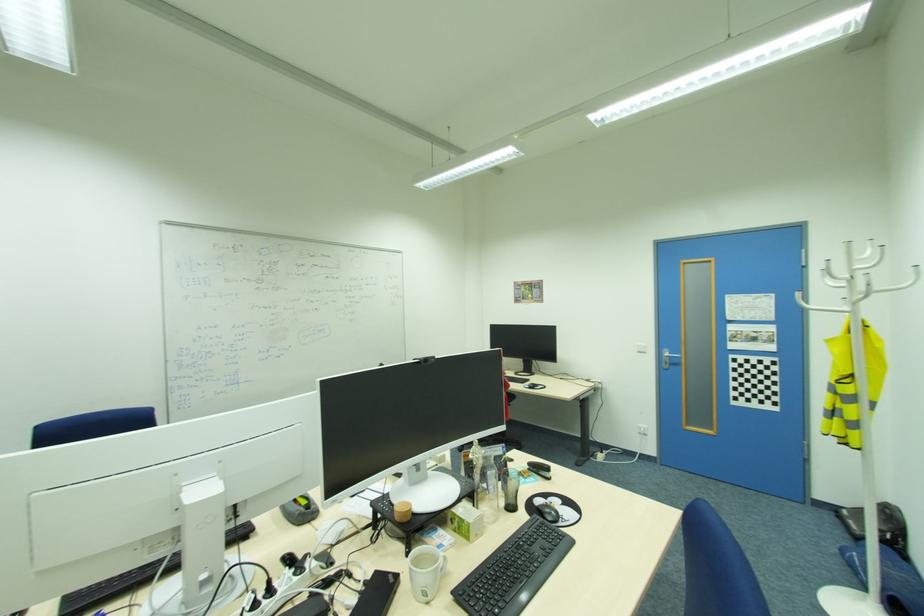
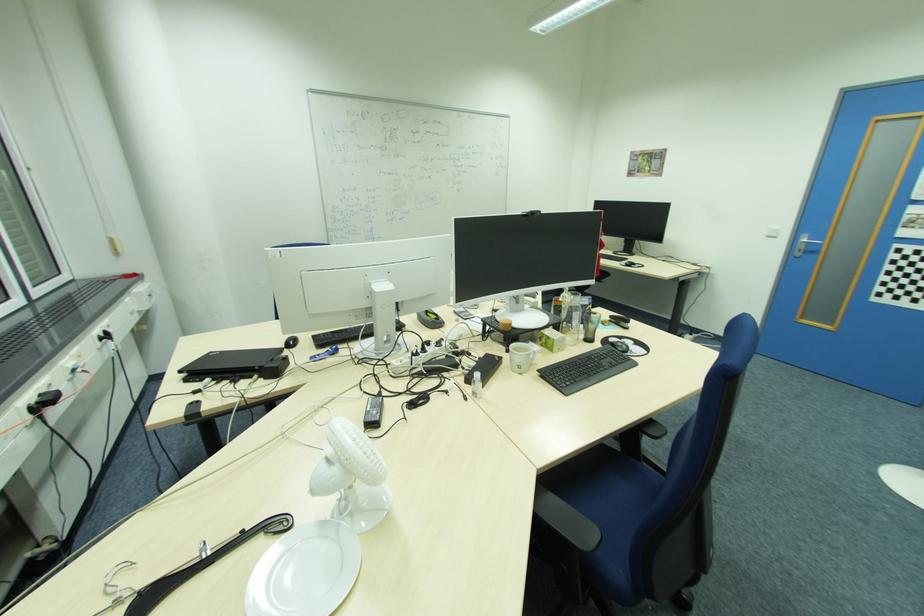
Locate, in the second image, the point that corresponds to (x=480, y=535) in the first image.

(562, 349)